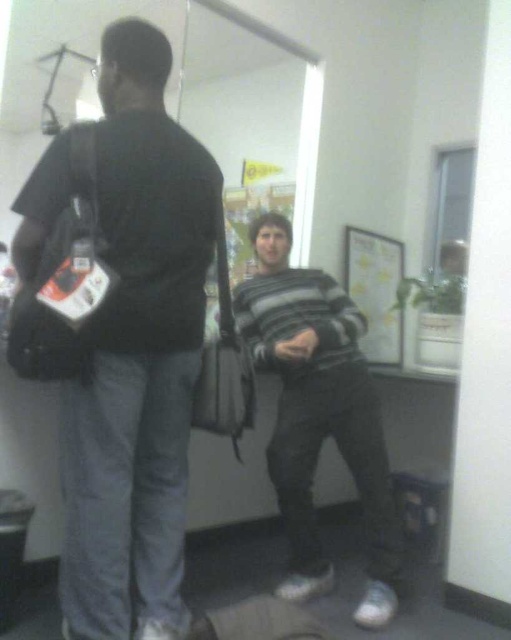
Does black matte bag at left appear on the right side of striped sweater at center?

Incorrect, black matte bag at left is not on the right side of striped sweater at center.

Describe the element at coordinates (121, 336) in the screenshot. I see `black matte bag at left` at that location.

Locate an element on the screen. The image size is (511, 640). black matte bag at left is located at coordinates (121, 336).